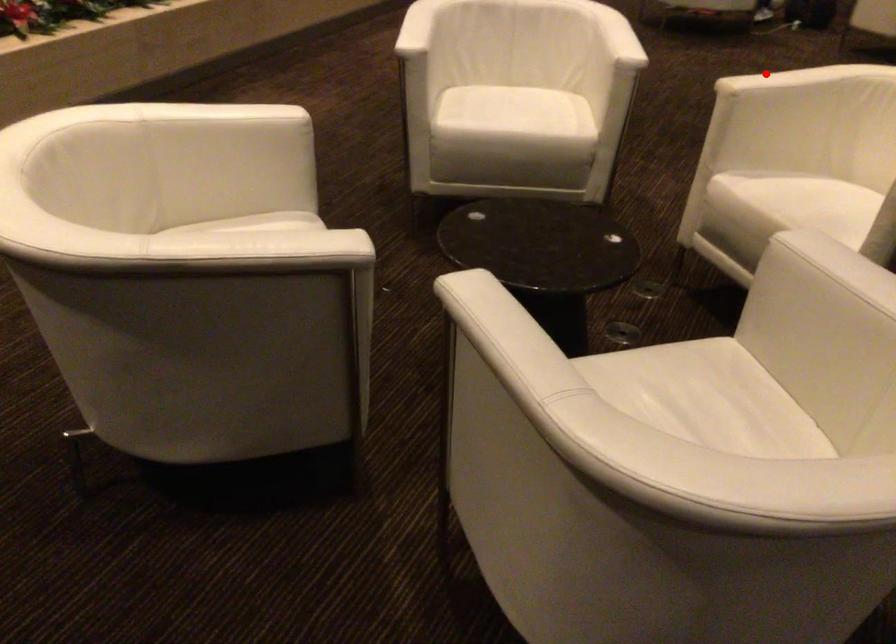
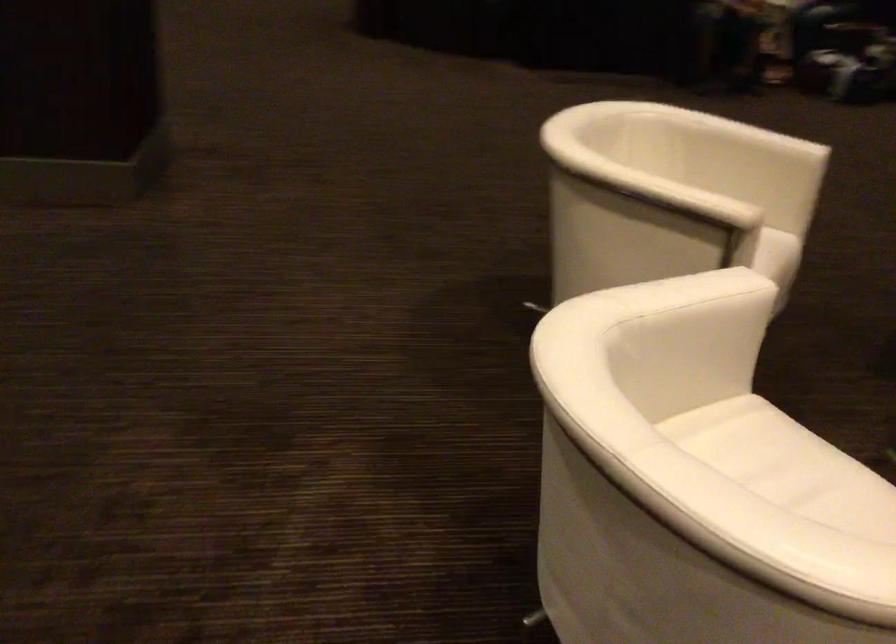
The point at the highlighted location is marked in the first image. Where is the corresponding point in the second image?

(675, 194)